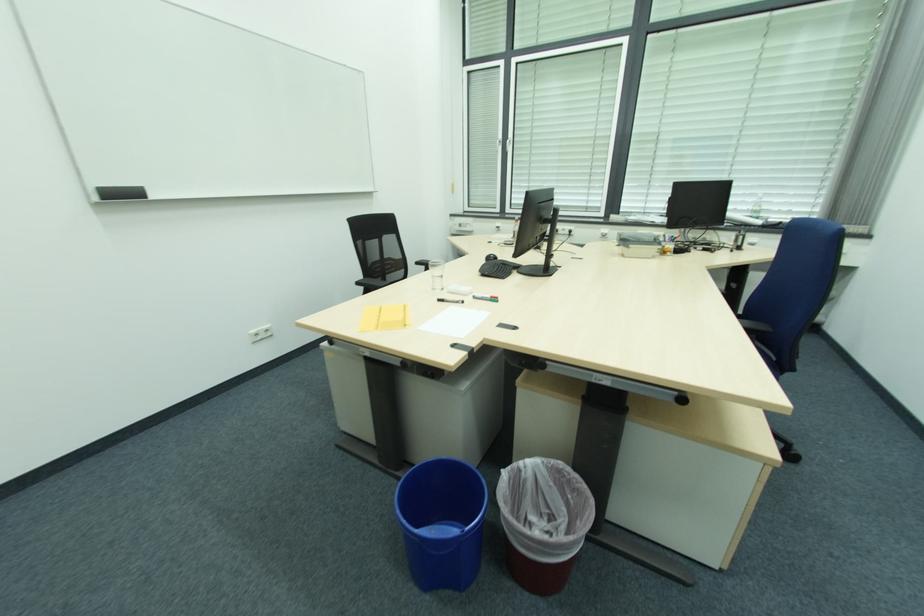
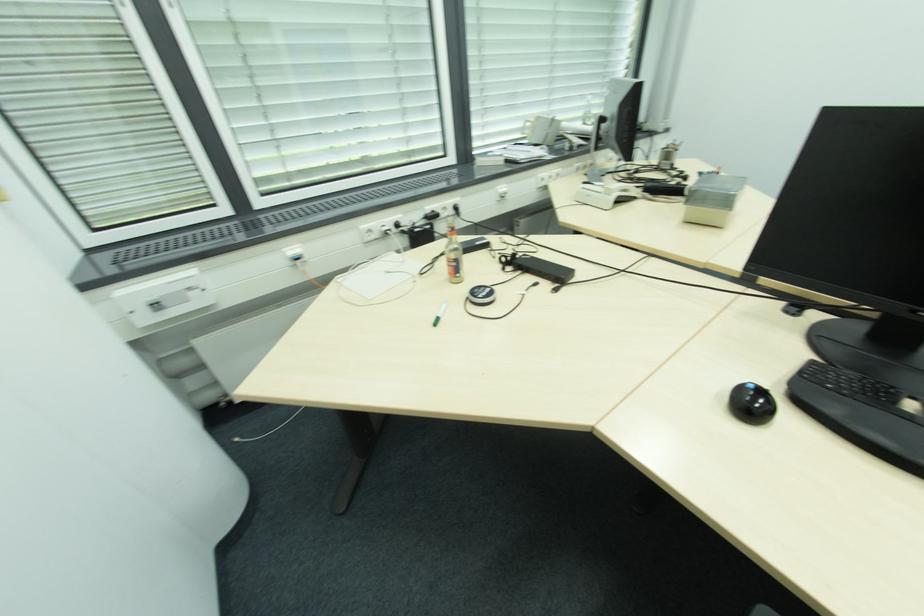
The point at (492, 241) is marked in the first image. Where is the corresponding point in the second image?

(436, 321)